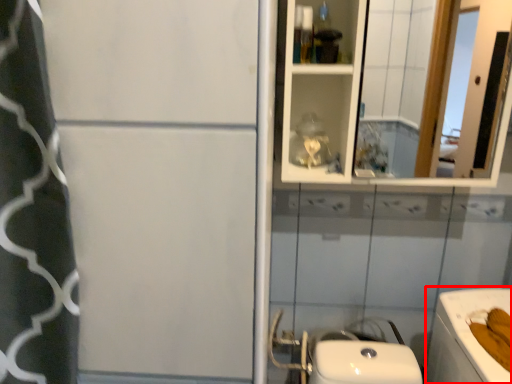
Question: From the image's perspective, where is bath (annotated by the red box) located relative to mirror?

Choices:
 (A) below
 (B) above

Answer: (A)